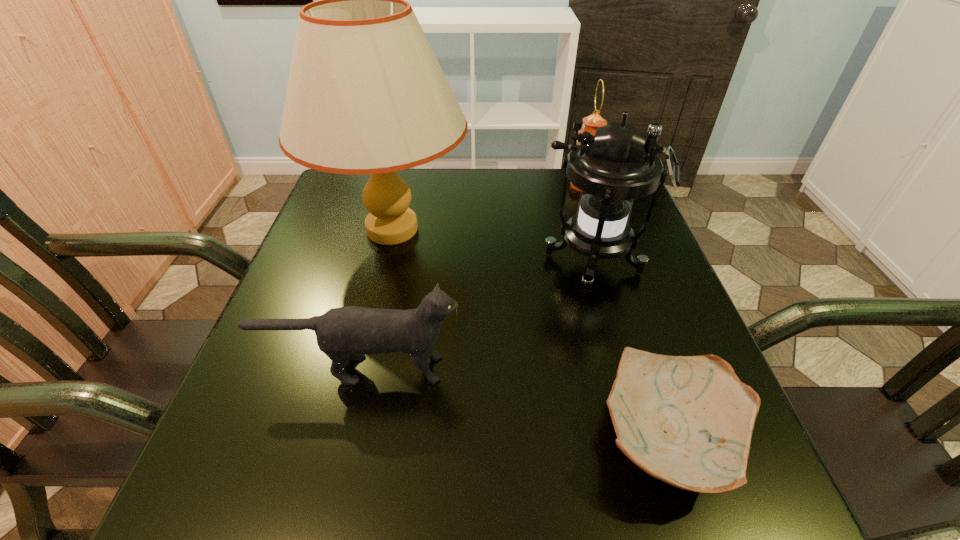
Locate an element on the screen. This screenshot has height=540, width=960. lampshade is located at coordinates point(366,95).

I want to click on the second tallest object, so point(613,168).

You are a GUI agent. You are given a task and a screenshot of the screen. Output one action in this format:
    pyautogui.click(x=<x>, y=<y>)
    Task: Click on the oil lamp
    The width and height of the screenshot is (960, 540).
    Given the screenshot: What is the action you would take?
    pyautogui.click(x=591, y=123)

I want to click on cat, so click(x=348, y=333).

Find the location of `pottery`. pottery is located at coordinates (686, 420).

Identify the location of vacant space located on the front of the lampshade. Image resolution: width=960 pixels, height=540 pixels. (364, 347).

Where is `vacant space located 0.220m on the back of the lantern`? This screenshot has height=540, width=960. vacant space located 0.220m on the back of the lantern is located at coordinates (571, 186).

The height and width of the screenshot is (540, 960). In order to click on vacant space located 0.390m on the front of the third shortest object in this screenshot , I will do [621, 299].

At what (x,y) coordinates should I click in order to perform the action: click on vacant space located 0.120m on the front-facing side of the cat. Please return your answer as a coordinate pair (x, y). Image resolution: width=960 pixels, height=540 pixels. Looking at the image, I should click on (530, 369).

At what (x,y) coordinates should I click in order to perform the action: click on blank space located 0.100m on the back of the shortest object. Please return your answer as a coordinate pair (x, y). Image resolution: width=960 pixels, height=540 pixels. Looking at the image, I should click on click(634, 332).